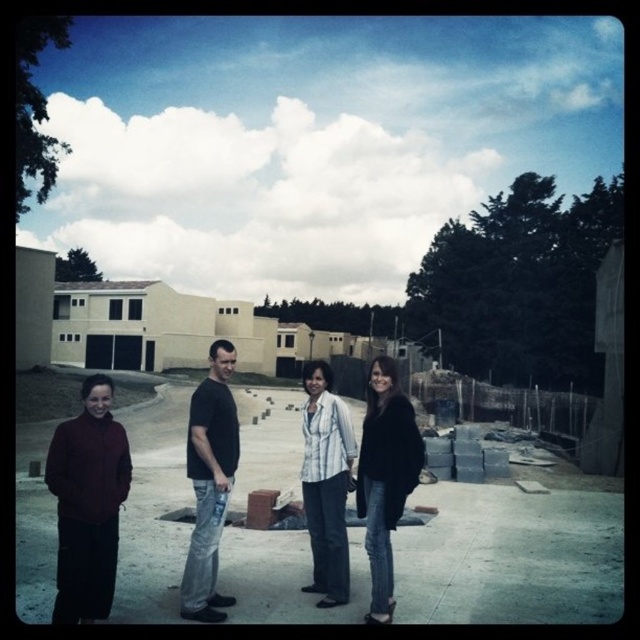
Question: Which point is farther to the camera?

Choices:
 (A) (76, 452)
 (B) (339, 451)
 (C) (212, 435)

Answer: (B)

Question: Is maroon fleece jacket at lower left below white striped shirt at center?

Choices:
 (A) yes
 (B) no

Answer: (A)

Question: Can you confirm if brick wall at center is positioned to the right of black cotton t-shirt at center?

Choices:
 (A) yes
 (B) no

Answer: (A)

Question: Among these objects, which one is nearest to the camera?

Choices:
 (A) maroon fleece jacket at lower left
 (B) brick wall at center
 (C) white striped shirt at center
 (D) black cotton t-shirt at center

Answer: (A)

Question: In this image, where is brick wall at center located relative to black fuzzy coat at center?

Choices:
 (A) left
 (B) right

Answer: (A)

Question: Among these points, which one is nearest to the camera?

Choices:
 (A) (369, 536)
 (B) (321, 410)
 (C) (58, 493)

Answer: (C)